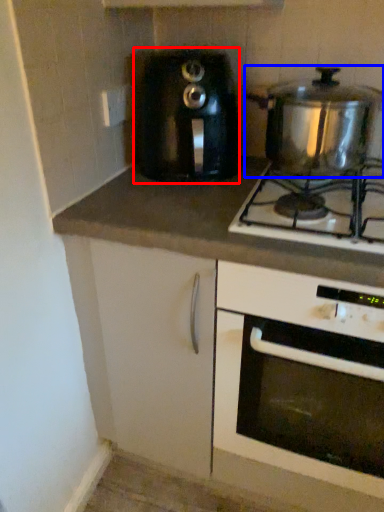
Question: Among these objects, which one is nearest to the camera, toaster (highlighted by a red box) or kitchen appliance (highlighted by a blue box)?

Choices:
 (A) toaster
 (B) kitchen appliance

Answer: (B)